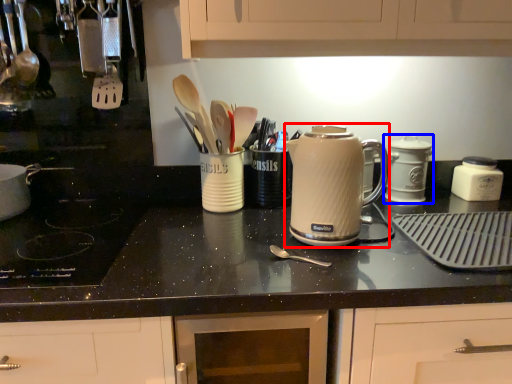
Question: Which object is further to the camera taking this photo, kitchen appliance (highlighted by a red box) or kitchen appliance (highlighted by a blue box)?

Choices:
 (A) kitchen appliance
 (B) kitchen appliance

Answer: (B)